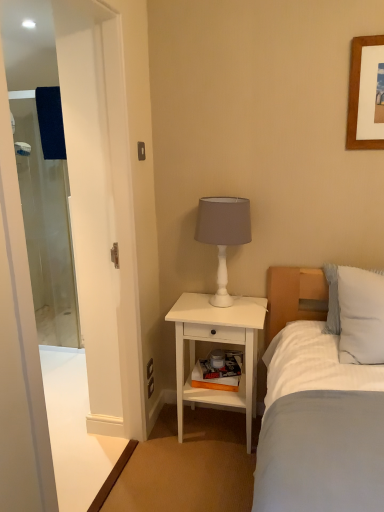
Question: Based on their positions, is white striped pillow at right located to the left or right of transparent glass screen door at left, the second screen door viewed from the back?

Choices:
 (A) right
 (B) left

Answer: (A)

Question: Looking at the image, does white striped pillow at right seem bigger or smaller compared to transparent glass screen door at left, acting as the 1th screen door starting from the front?

Choices:
 (A) big
 (B) small

Answer: (B)

Question: Which object is positioned farthest from the transparent glass screen door at left, acting as the 1th screen door starting from the right?

Choices:
 (A) white matte nightstand at center
 (B) clear glass screen door at left, the 2th screen door in the right-to-left sequence
 (C) white matte table lamp at upper right
 (D) white striped pillow at right

Answer: (B)

Question: Which of these objects is positioned farthest from the white striped pillow at right?

Choices:
 (A) white matte nightstand at center
 (B) transparent glass screen door at left, acting as the 1th screen door starting from the front
 (C) white matte table lamp at upper right
 (D) clear glass screen door at left, arranged as the 1th screen door when viewed from the back

Answer: (D)